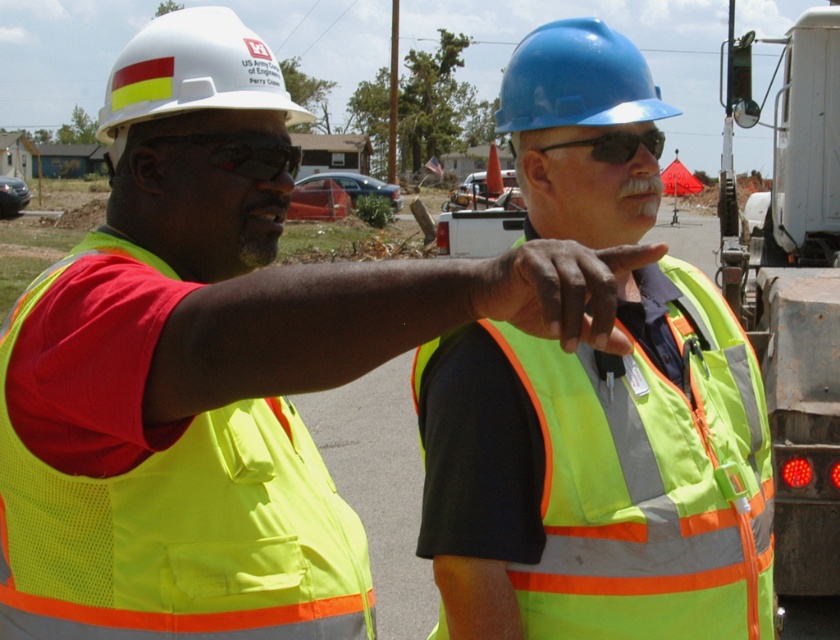
Does high-visibility fabric safety vest at left have a lesser width compared to black plastic goggles at upper center?

Incorrect, high-visibility fabric safety vest at left's width is not less than black plastic goggles at upper center's.

Measure the distance between high-visibility fabric safety vest at left and black plastic goggles at upper center.

32.24 inches

This screenshot has height=640, width=840. Describe the element at coordinates (177, 524) in the screenshot. I see `high-visibility fabric safety vest at left` at that location.

Identify the location of high-visibility fabric safety vest at left. (177, 524).

Which is more to the left, white hard hat at upper left or matte black goggles at center?

From the viewer's perspective, white hard hat at upper left appears more on the left side.

Is point (255, 44) farther from camera compared to point (193, 134)?

Yes, it is.

Which is behind, point (148, 44) or point (231, 161)?

The point (231, 161) is more distant.

The image size is (840, 640). What are the coordinates of `white hard hat at upper left` in the screenshot? It's located at (193, 72).

Is high-visibility fabric safety vest at center wider than blue hard hat at upper center?

Yes.

Between high-visibility fabric safety vest at center and blue hard hat at upper center, which one has more height?

blue hard hat at upper center

Where is `high-visibility fabric safety vest at center`? high-visibility fabric safety vest at center is located at coordinates (649, 481).